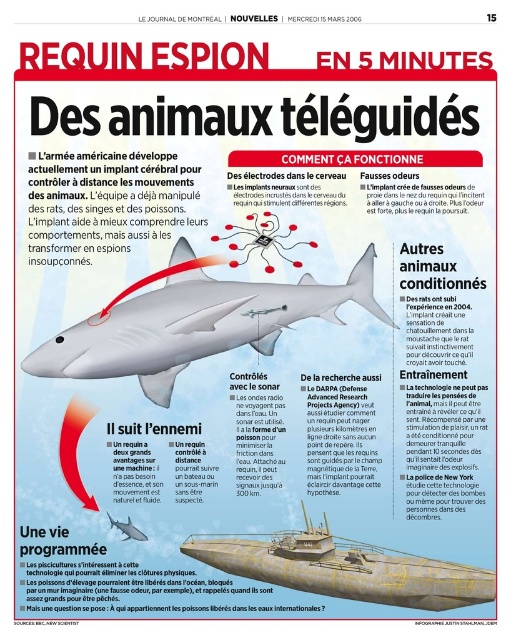
Based on the scene described, which object, the matte black shark at center or the brushed metal submarine at lower center, is bigger in size?

The matte black shark at center is larger in size compared to the brushed metal submarine at lower center according to the description.

Based on the scene description, which object is taller between the matte black shark at center and the brushed metal submarine at lower center?

The matte black shark at center is much taller than the brushed metal submarine at lower center.

You are a journalist examining the layout of this newspaper page. The article about spy animals includes two images. Which object, the matte black shark at center or the brushed metal submarine at lower center, appears closer to the reader?

The matte black shark at center appears closer to the reader because the brushed metal submarine at lower center is behind it.